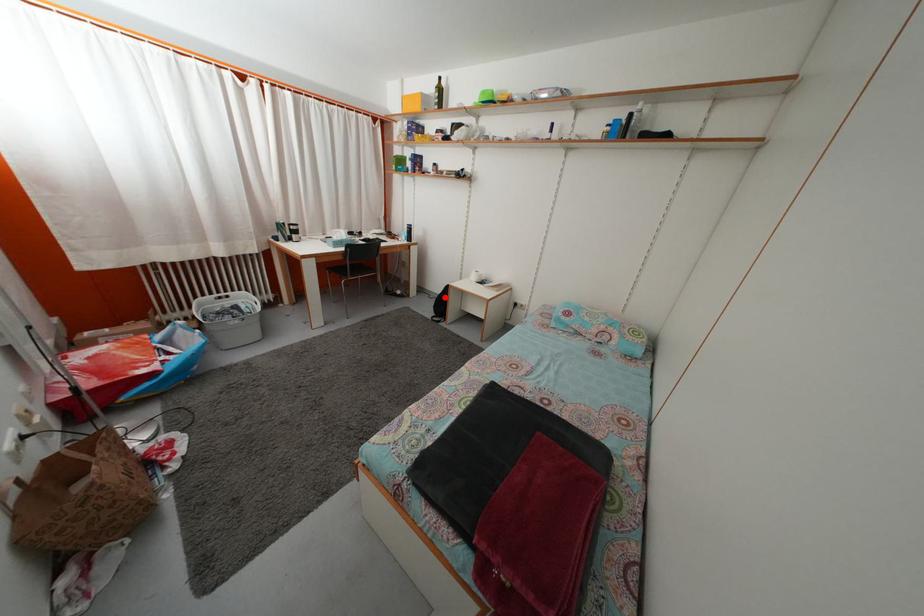
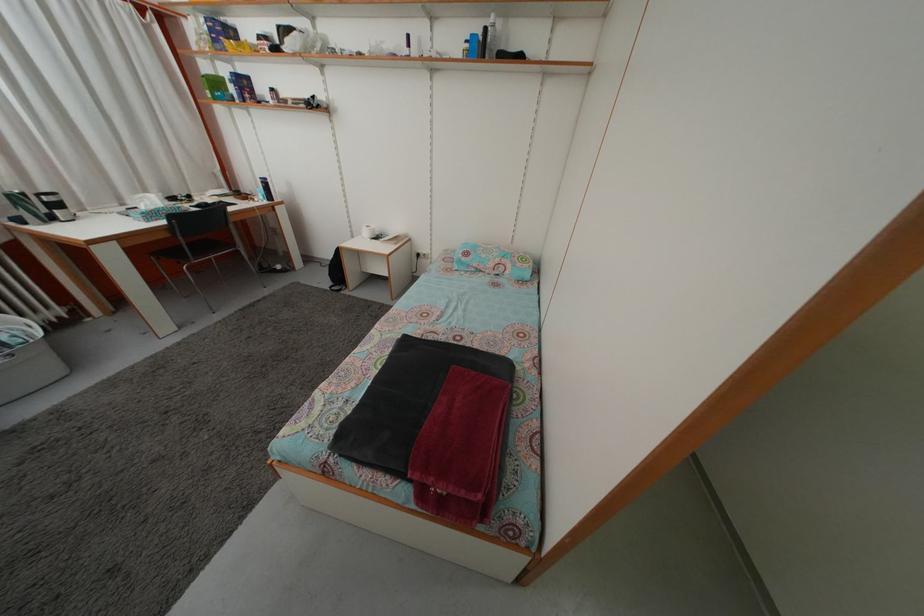
Question: I am providing you with two images of the same scene from different viewpoints. A red point is marked on the first image. At the location where the point appears in image 1, is it still visible in image 2?

Choices:
 (A) Yes
 (B) No

Answer: (A)